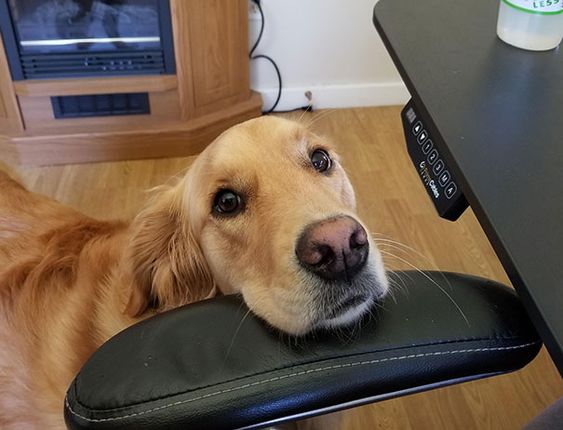
Identify the location of armrest. The width and height of the screenshot is (563, 430). (200, 372).